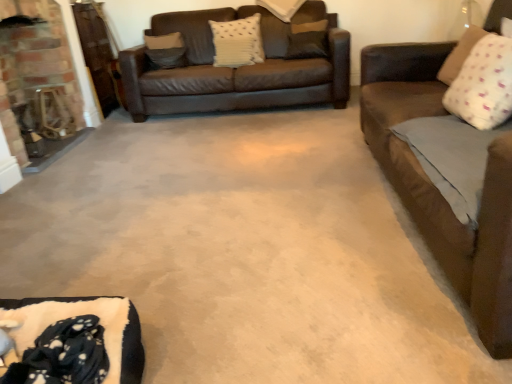
Question: Can you confirm if white dotted pillow at upper right, acting as the second pillow starting from the front, is smaller than white textured pillow at center, positioned as the fourth pillow in back-to-front order?

Choices:
 (A) yes
 (B) no

Answer: (A)

Question: Is white dotted pillow at upper right, acting as the second pillow starting from the front, closer to camera compared to white textured pillow at center, the 3th pillow viewed from the front?

Choices:
 (A) no
 (B) yes

Answer: (B)

Question: Can you confirm if white dotted pillow at upper right, the first pillow when ordered from right to left, is taller than white textured pillow at center, the 5th pillow when ordered from right to left?

Choices:
 (A) yes
 (B) no

Answer: (B)

Question: Is white dotted pillow at upper right, marked as the 5th pillow in a back-to-front arrangement, far away from white textured pillow at center, marked as the second pillow in a left-to-right arrangement?

Choices:
 (A) no
 (B) yes

Answer: (B)

Question: Does white dotted pillow at upper right, the first pillow when ordered from right to left, have a greater width compared to white textured pillow at center, the 3th pillow viewed from the front?

Choices:
 (A) no
 (B) yes

Answer: (B)

Question: Does white dotted pillow at upper right, marked as the 5th pillow in a back-to-front arrangement, appear on the right side of white textured pillow at center, positioned as the fourth pillow in back-to-front order?

Choices:
 (A) yes
 (B) no

Answer: (A)

Question: From a real-world perspective, is white textured pillow at upper center, placed as the 5th pillow when sorted from front to back, over suede-like beige pillow at upper left, which is the first pillow from back to front?

Choices:
 (A) yes
 (B) no

Answer: (A)

Question: Is the depth of white textured pillow at upper center, placed as the 5th pillow when sorted from front to back, greater than that of suede-like beige pillow at upper left, which is the first pillow from back to front?

Choices:
 (A) no
 (B) yes

Answer: (A)

Question: Considering the relative sizes of white textured pillow at upper center, the third pillow viewed from the left, and suede-like beige pillow at upper left, which is the 6th pillow from right to left, in the image provided, is white textured pillow at upper center, the third pillow viewed from the left, bigger than suede-like beige pillow at upper left, which is the 6th pillow from right to left,?

Choices:
 (A) yes
 (B) no

Answer: (A)

Question: Is white textured pillow at upper center, the fourth pillow viewed from the right, positioned before suede-like beige pillow at upper left, the 6th pillow viewed from the front?

Choices:
 (A) no
 (B) yes

Answer: (B)

Question: Would you say white textured pillow at upper center, the fourth pillow viewed from the right, contains suede-like beige pillow at upper left, the 6th pillow viewed from the front?

Choices:
 (A) no
 (B) yes

Answer: (A)

Question: Can you confirm if white textured pillow at upper center, placed as the 5th pillow when sorted from front to back, is wider than suede-like beige pillow at upper left, the 6th pillow viewed from the front?

Choices:
 (A) no
 (B) yes

Answer: (B)

Question: Does brick fireplace at left have a smaller size compared to brown fabric pillow at upper center, which is counted as the 3th pillow, starting from the back?

Choices:
 (A) yes
 (B) no

Answer: (B)